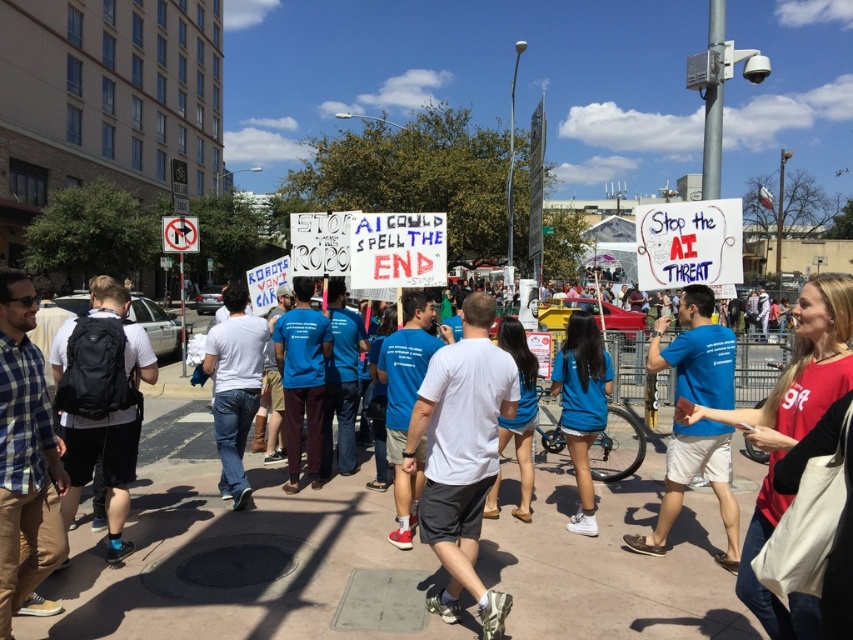
Question: Among these points, which one is farthest from the camera?

Choices:
 (A) (213, 390)
 (B) (450, 484)

Answer: (A)

Question: Where is white cotton t-shirt at center located in relation to white cotton shirt at center in the image?

Choices:
 (A) right
 (B) left

Answer: (A)

Question: Is white cotton t-shirt at center further to camera compared to white cotton shirt at center?

Choices:
 (A) no
 (B) yes

Answer: (A)

Question: Can you confirm if white cotton t-shirt at center is bigger than white cotton shirt at center?

Choices:
 (A) yes
 (B) no

Answer: (B)

Question: Among these objects, which one is nearest to the camera?

Choices:
 (A) white cotton shirt at center
 (B) white cotton t-shirt at center

Answer: (B)

Question: Among these objects, which one is nearest to the camera?

Choices:
 (A) white cotton shirt at center
 (B) white cotton t-shirt at center

Answer: (B)